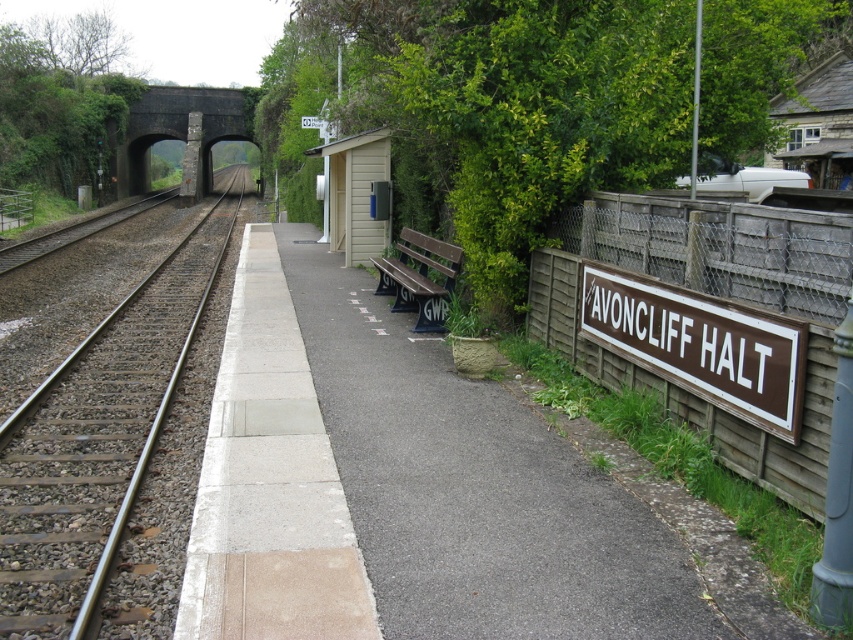
Who is higher up, brown wooden sign at right or brown wooden bench at center?

brown wooden bench at center is higher up.

Between point (722, 406) and point (430, 316), which one is positioned in front?

Positioned in front is point (722, 406).

This screenshot has height=640, width=853. What are the coordinates of `brown wooden sign at right` in the screenshot? It's located at (700, 346).

Can you confirm if smooth metal tracks at center is bigger than brown wooden bench at center?

Yes, smooth metal tracks at center is bigger than brown wooden bench at center.

Who is shorter, smooth metal tracks at center or brown wooden bench at center?

Standing shorter between the two is brown wooden bench at center.

You are a GUI agent. You are given a task and a screenshot of the screen. Output one action in this format:
    pyautogui.click(x=<x>, y=<y>)
    Task: Click on the smooth metal tracks at center
    The height and width of the screenshot is (640, 853).
    Given the screenshot: What is the action you would take?
    pyautogui.click(x=96, y=442)

What are the coordinates of `smooth metal tracks at center` in the screenshot? It's located at (96, 442).

Is smooth metal tracks at center bigger than brown wooden sign at right?

Correct, smooth metal tracks at center is larger in size than brown wooden sign at right.

At what (x,y) coordinates should I click in order to perform the action: click on smooth metal tracks at center. Please return your answer as a coordinate pair (x, y). Looking at the image, I should click on (96, 442).

You are a GUI agent. You are given a task and a screenshot of the screen. Output one action in this format:
    pyautogui.click(x=<x>, y=<y>)
    Task: Click on the smooth metal tracks at center
    
    Given the screenshot: What is the action you would take?
    pyautogui.click(x=96, y=442)